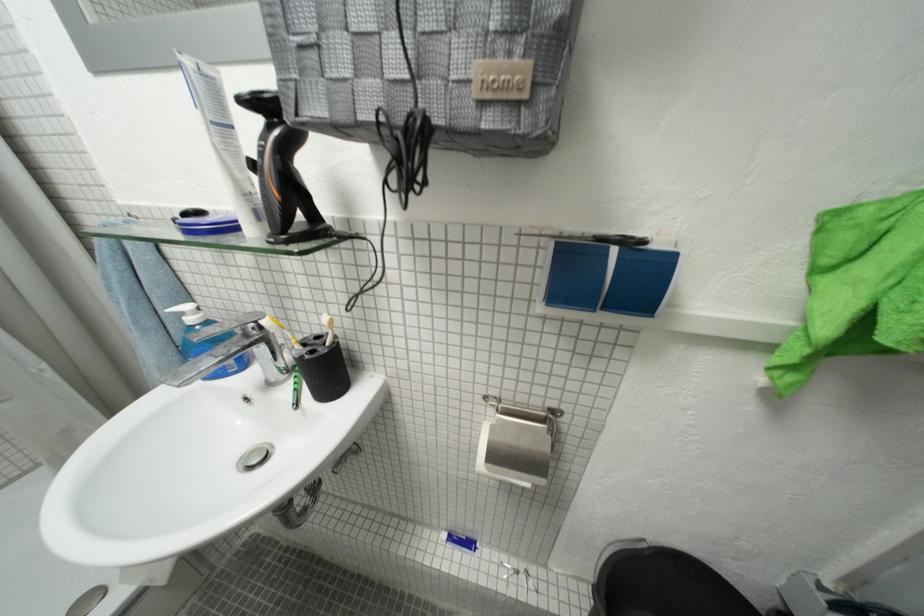
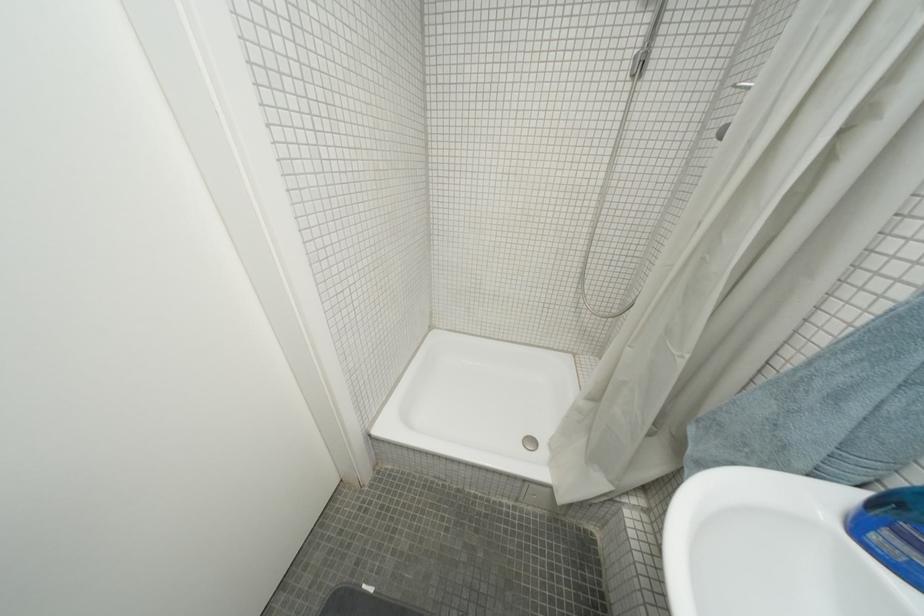
Locate, in the second image, the point that corresponds to the point at 53,368 in the first image.

(697, 359)